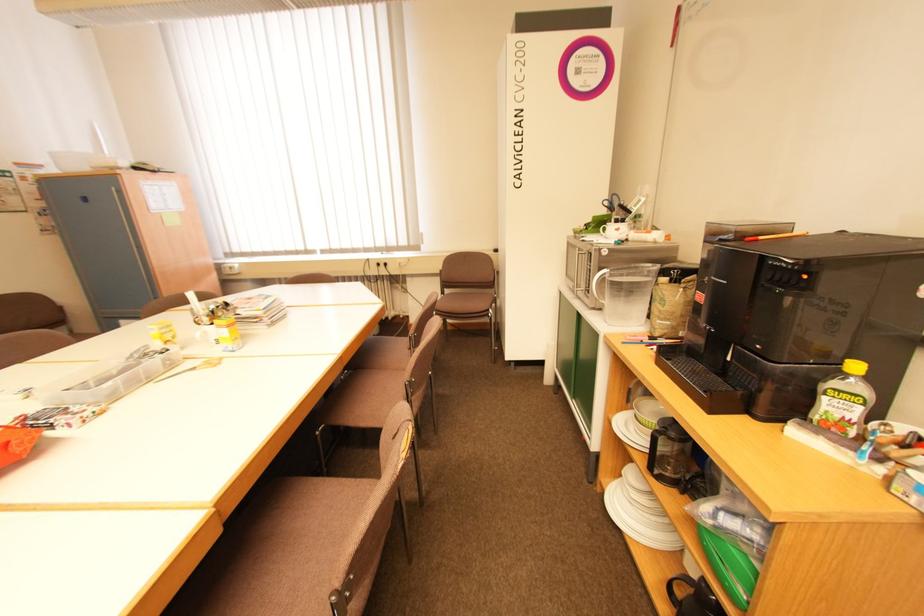
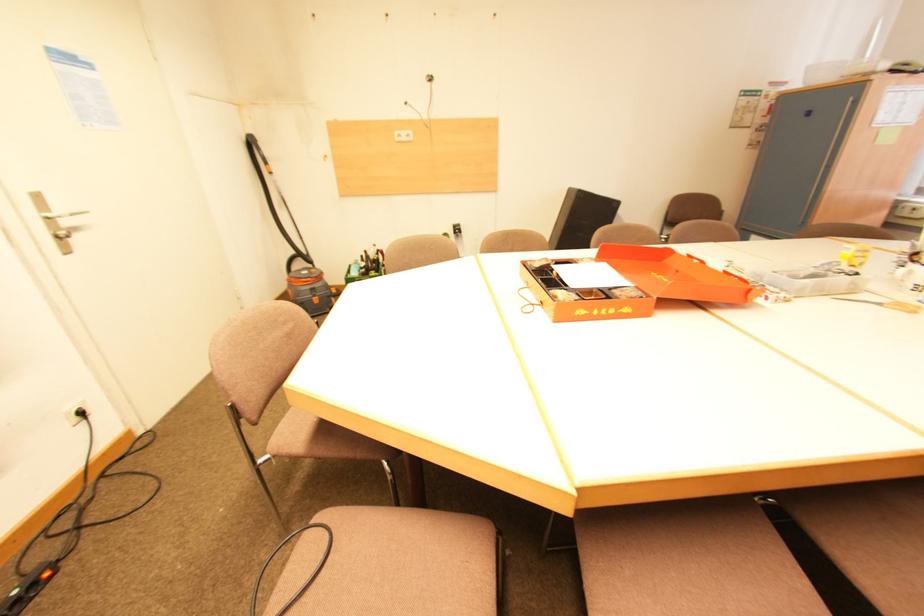
Based on the continuous images, in which direction is the camera rotating?

The camera rotated toward left-down.